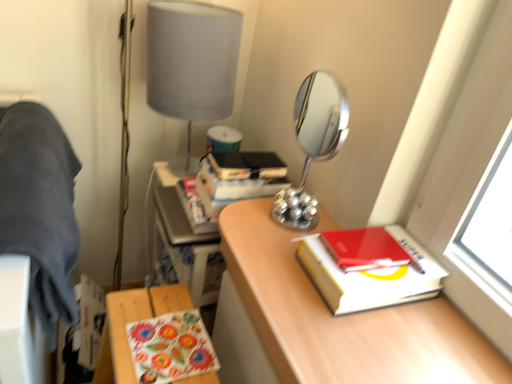
Question: Is chrome/metallic mirror at center not inside matte gray lampshade at upper center?

Choices:
 (A) no
 (B) yes

Answer: (B)

Question: Is chrome/metallic mirror at center shorter than matte gray lampshade at upper center?

Choices:
 (A) no
 (B) yes

Answer: (B)

Question: Does chrome/metallic mirror at center have a lesser width compared to matte gray lampshade at upper center?

Choices:
 (A) no
 (B) yes

Answer: (B)

Question: Is the position of chrome/metallic mirror at center less distant than that of matte gray lampshade at upper center?

Choices:
 (A) yes
 (B) no

Answer: (A)

Question: Is chrome/metallic mirror at center next to matte gray lampshade at upper center?

Choices:
 (A) yes
 (B) no

Answer: (B)

Question: Relative to floral fabric table at lower left, is hardcover book at right in front or behind?

Choices:
 (A) behind
 (B) front

Answer: (B)

Question: From the image's perspective, is hardcover book at right above or below floral fabric table at lower left?

Choices:
 (A) below
 (B) above

Answer: (B)

Question: Is hardcover book at right wider or thinner than floral fabric table at lower left?

Choices:
 (A) wide
 (B) thin

Answer: (A)

Question: Does point (339, 302) appear closer or farther from the camera than point (111, 302)?

Choices:
 (A) farther
 (B) closer

Answer: (B)

Question: Considering the positions of point (409, 246) and point (331, 251), is point (409, 246) closer or farther from the camera than point (331, 251)?

Choices:
 (A) closer
 (B) farther

Answer: (B)

Question: From their relative heights in the image, would you say hardcover book at right is taller or shorter than red matte notebook at right?

Choices:
 (A) tall
 (B) short

Answer: (A)

Question: Looking at the image, does hardcover book at right seem bigger or smaller compared to red matte notebook at right?

Choices:
 (A) big
 (B) small

Answer: (A)

Question: Is hardcover book at right situated inside red matte notebook at right or outside?

Choices:
 (A) inside
 (B) outside

Answer: (B)

Question: In terms of height, does chrome/metallic mirror at center look taller or shorter compared to red matte notebook at right?

Choices:
 (A) tall
 (B) short

Answer: (A)

Question: Is chrome/metallic mirror at center situated inside red matte notebook at right or outside?

Choices:
 (A) inside
 (B) outside

Answer: (B)